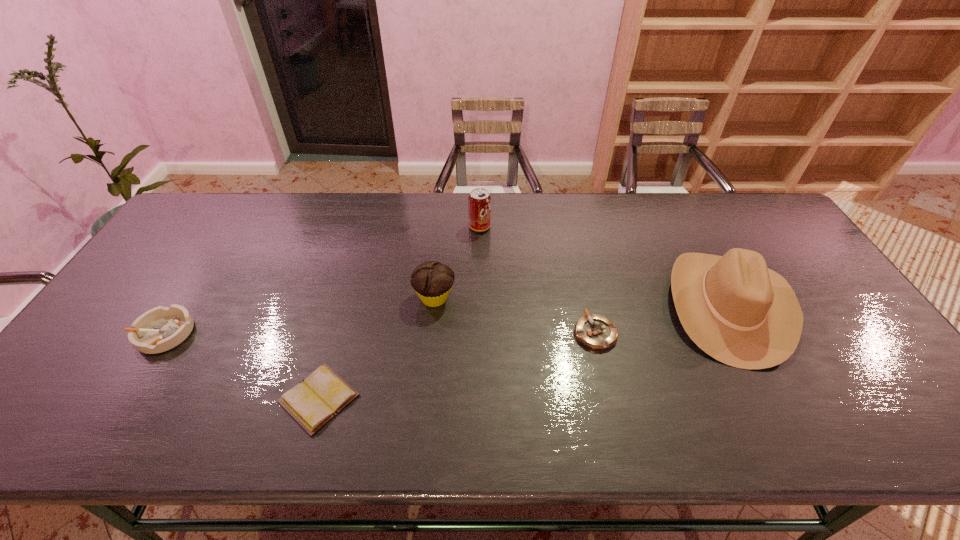
Image resolution: width=960 pixels, height=540 pixels. I want to click on the shortest object, so click(x=313, y=402).

This screenshot has width=960, height=540. In order to click on the fifth object from right to left in this screenshot , I will do `click(313, 402)`.

The width and height of the screenshot is (960, 540). Identify the location of free spot located 0.060m on the back of the tallest object. pos(695,242).

This screenshot has width=960, height=540. I want to click on free spot located on the front of the third object from right to left, so click(x=480, y=244).

The image size is (960, 540). Identify the location of free space located on the left of the fourth shortest object. (302, 298).

The width and height of the screenshot is (960, 540). In order to click on free spot located on the right of the left ashtray in this screenshot , I will do `click(289, 333)`.

Where is `free space located on the right of the shorter ashtray`? The height and width of the screenshot is (540, 960). free space located on the right of the shorter ashtray is located at coordinates (647, 333).

Find the location of a particular element. vacant space located 0.260m on the left of the shortest object is located at coordinates (165, 399).

Locate an element on the screen. object present at the far edge is located at coordinates (479, 201).

Identify the location of object that is at the near edge. The image size is (960, 540). (313, 402).